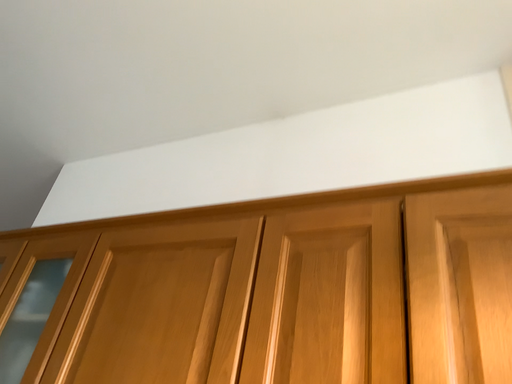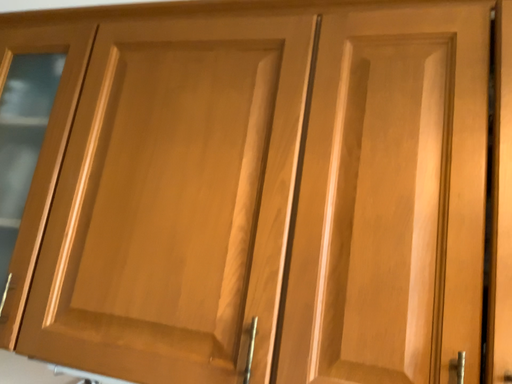
Question: How did the camera likely rotate when shooting the video?

Choices:
 (A) rotated left
 (B) rotated right

Answer: (B)